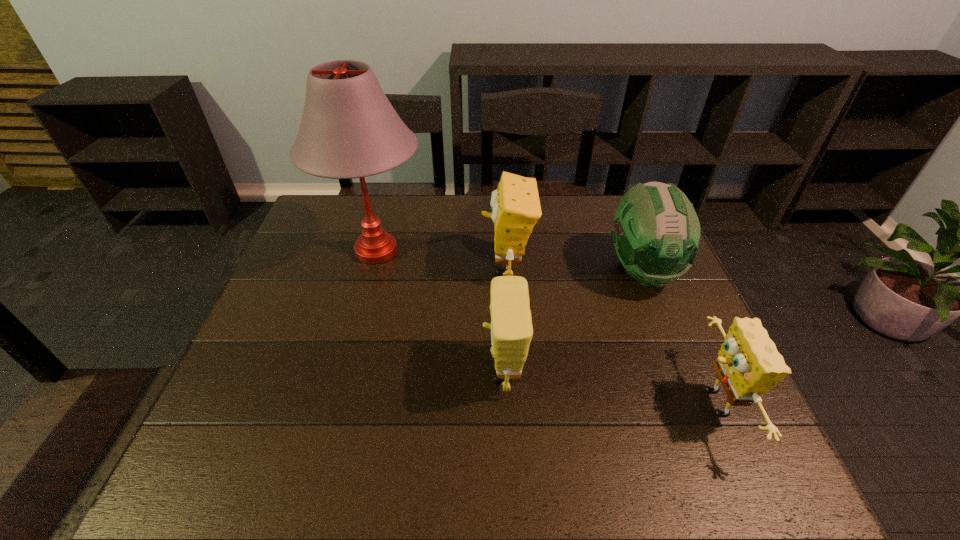
Find the location of a particular element. The height and width of the screenshot is (540, 960). blank space located 0.210m on the face of the rightmost sponge is located at coordinates (594, 403).

Where is `free space located 0.270m on the face of the rightmost sponge`? This screenshot has height=540, width=960. free space located 0.270m on the face of the rightmost sponge is located at coordinates (566, 403).

Find the location of a particular element. The height and width of the screenshot is (540, 960). vacant region located 0.390m on the face of the rightmost sponge is located at coordinates (511, 403).

The width and height of the screenshot is (960, 540). Find the location of `object that is at the far edge`. object that is at the far edge is located at coordinates (349, 129).

Locate an element on the screen. object that is at the near edge is located at coordinates (748, 365).

You are a GUI agent. You are given a task and a screenshot of the screen. Output one action in this format:
    pyautogui.click(x=<x>, y=<y>)
    Task: Click on the object that is at the left edge
    
    Given the screenshot: What is the action you would take?
    pyautogui.click(x=349, y=129)

The height and width of the screenshot is (540, 960). Find the location of `football helmet that is positioned at the right edge`. football helmet that is positioned at the right edge is located at coordinates (656, 233).

At what (x,y) coordinates should I click in order to perform the action: click on sponge that is at the right edge. Please return your answer as a coordinate pair (x, y). The height and width of the screenshot is (540, 960). Looking at the image, I should click on (748, 365).

Find the location of a particular element. This screenshot has height=540, width=960. object present at the far left corner is located at coordinates (349, 129).

You are a GUI agent. You are given a task and a screenshot of the screen. Output one action in this format:
    pyautogui.click(x=<x>, y=<y>)
    Task: Click on the object that is at the near right corner
    The height and width of the screenshot is (540, 960).
    Given the screenshot: What is the action you would take?
    pyautogui.click(x=748, y=365)